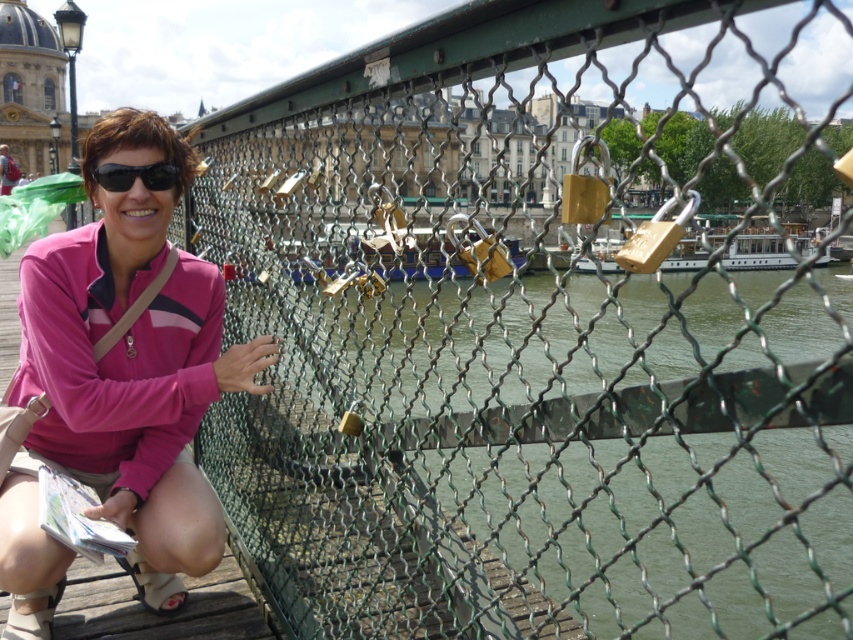
Question: Is pink fabric at left to the right of black matte sunglasses at left from the viewer's perspective?

Choices:
 (A) no
 (B) yes

Answer: (A)

Question: Which object is farther from the camera taking this photo?

Choices:
 (A) pink fabric at left
 (B) black matte sunglasses at left

Answer: (B)

Question: Does pink fabric at left have a larger size compared to black matte sunglasses at left?

Choices:
 (A) no
 (B) yes

Answer: (B)

Question: Does pink fabric at left appear on the left side of black matte sunglasses at left?

Choices:
 (A) yes
 (B) no

Answer: (A)

Question: Which object appears closest to the camera in this image?

Choices:
 (A) pink fabric at left
 (B) black matte sunglasses at left

Answer: (A)